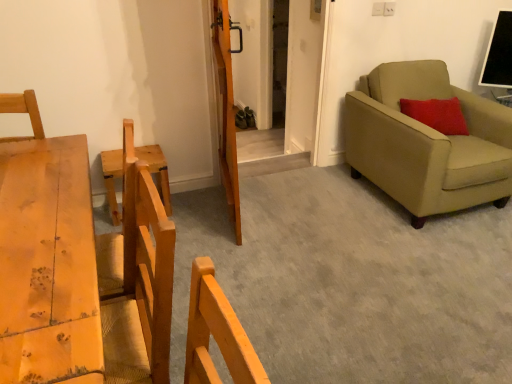
This screenshot has width=512, height=384. What are the coordinates of `vacant space in front of beige fabric armchair at right` in the screenshot? It's located at point(425,247).